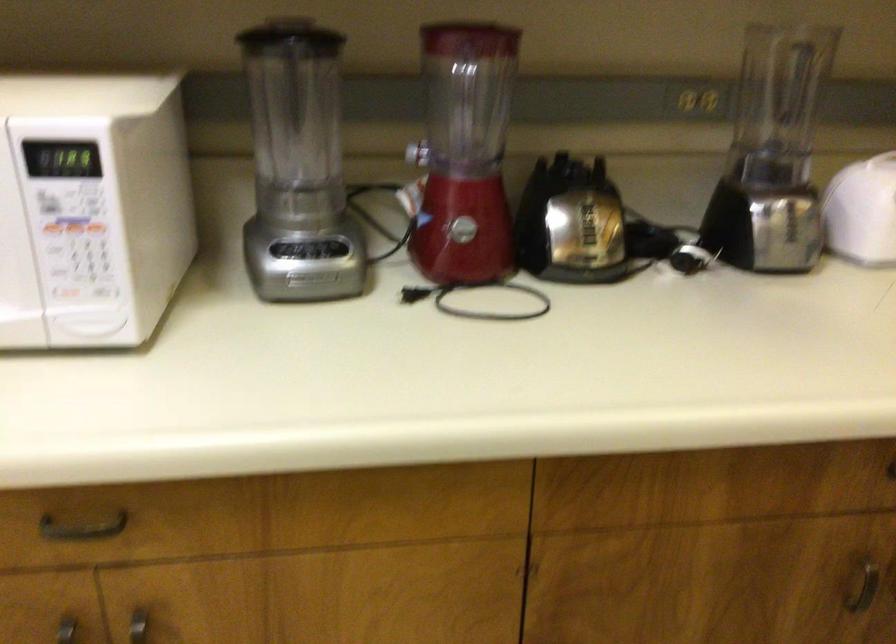
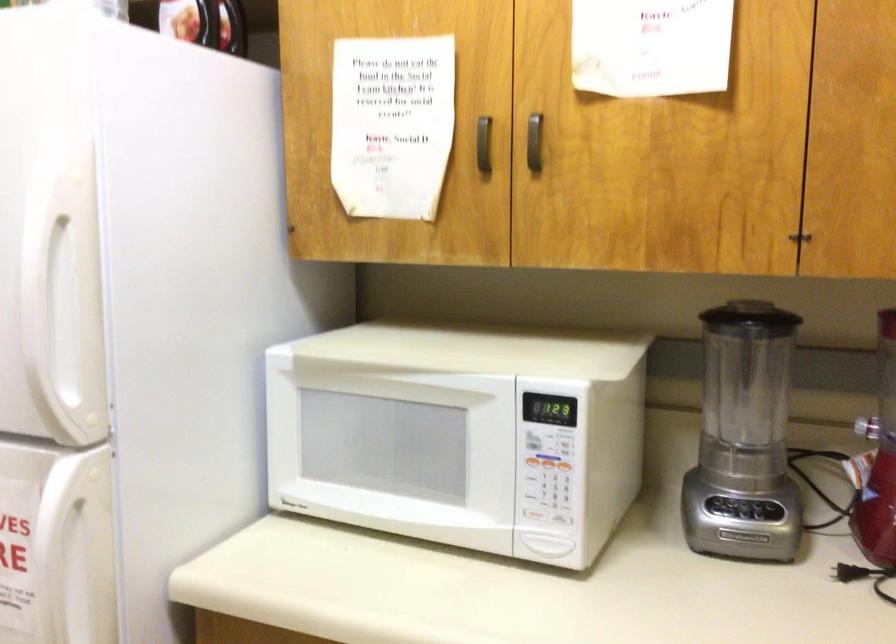
Where in the second image is the point corresponding to (288,250) from the first image?

(725, 506)